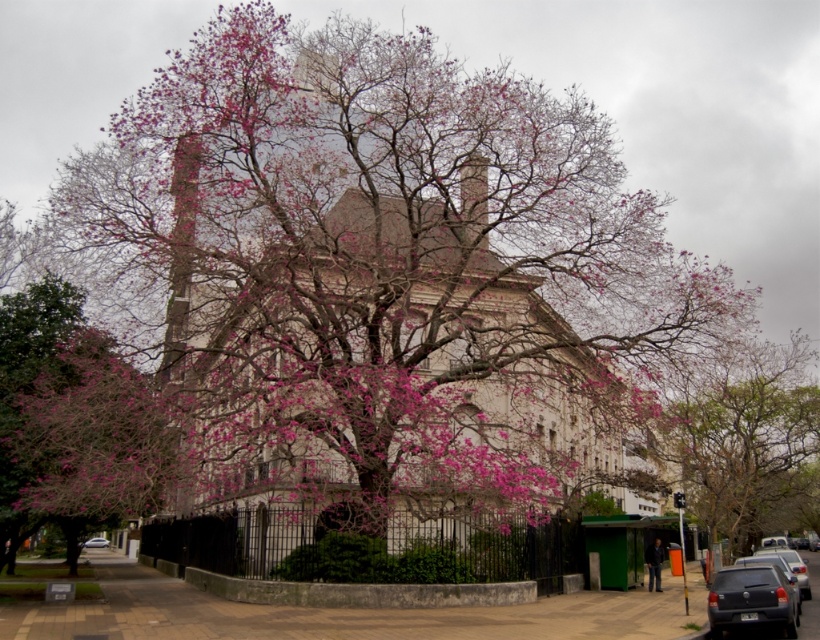
Question: Based on their relative distances, which object is nearer to the white glossy car at center?

Choices:
 (A) smooth beige church at center
 (B) metallic gray sedan at lower right

Answer: (A)

Question: In this image, where is smooth beige church at center located relative to pink bloom tree at center?

Choices:
 (A) above
 (B) below

Answer: (A)

Question: Estimate the real-world distances between objects in this image. Which object is farther from the smooth beige church at center?

Choices:
 (A) matte gray sedan at lower right
 (B) white glossy car at center

Answer: (B)

Question: Which point is farther to the camera?

Choices:
 (A) pink bloom tree at center
 (B) matte gray sedan at lower right
 (C) smooth beige church at center

Answer: (A)

Question: Can you confirm if smooth beige church at center is positioned to the left of metallic gray sedan at lower right?

Choices:
 (A) no
 (B) yes

Answer: (B)

Question: Is smooth beige church at center positioned behind matte gray sedan at lower right?

Choices:
 (A) yes
 (B) no

Answer: (A)